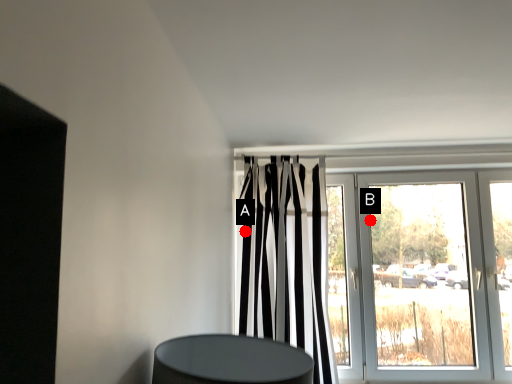
Question: Two points are circled on the image, labeled by A and B beside each circle. Which point appears farthest from the camera in this image?

Choices:
 (A) A is further
 (B) B is further

Answer: (B)